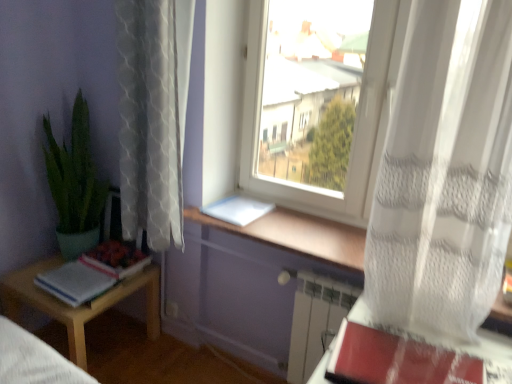
Locate an element on the screen. Image resolution: width=512 pixels, height=384 pixels. unoccupied region to the right of white paper at window, the 1th paperback book viewed from the top is located at coordinates (290, 223).